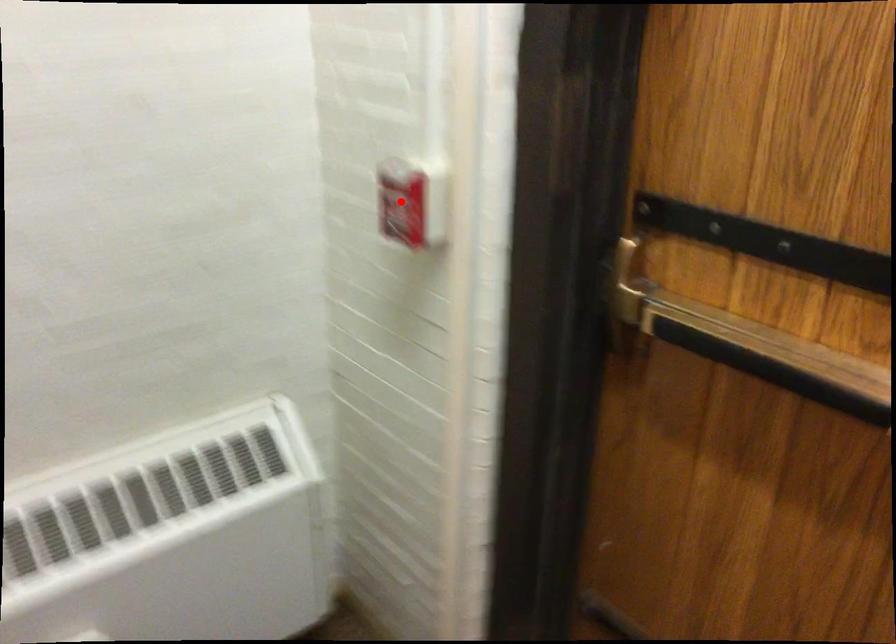
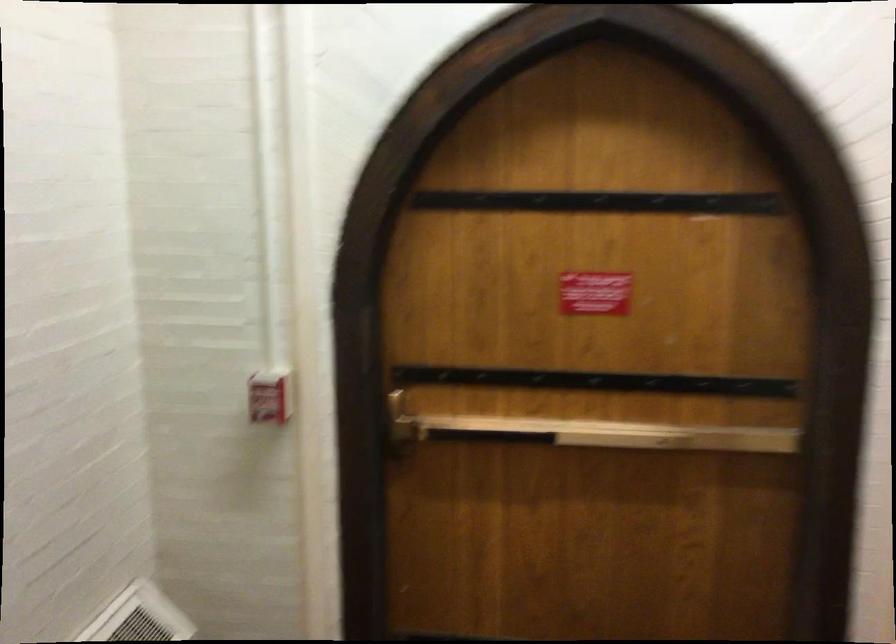
Question: I am providing you with two images of the same scene from different viewpoints. A red point is shown in image1. For the corresponding object point in image2, is it positioned nearer or farther from the camera?

Choices:
 (A) Nearer
 (B) Farther

Answer: (B)